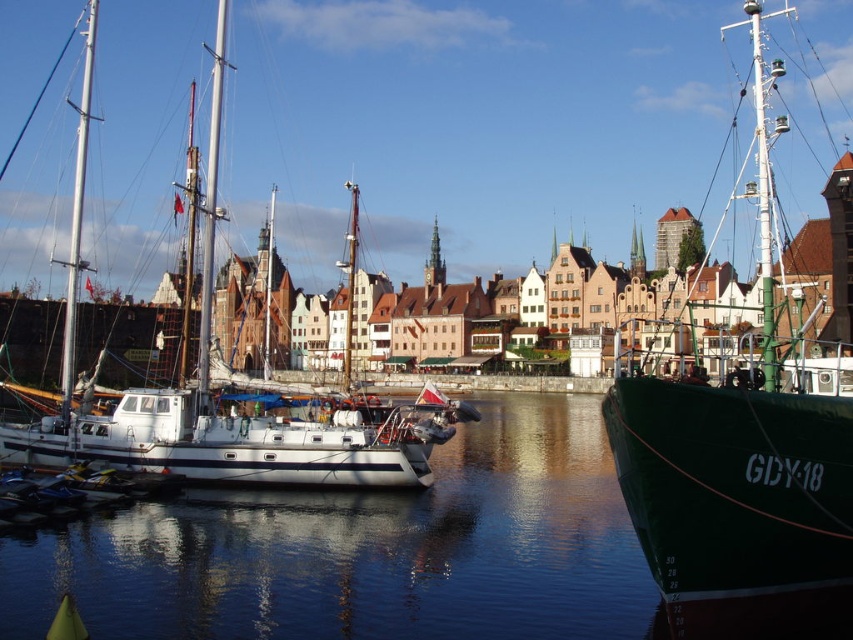
You are standing at the harbor and want to locate two specific points marked on a map. The first point is at coordinates point (583, 516) and the second is at point (393, 422). Based on the scene, which point is closer to you?

Point (583, 516) is in front of point (393, 422), so the first point is closer to you.

You are a photographer planning to capture the entire harbor scene. You notice the clear water at center and the white matte sailboat at left. Which object takes up more space in the image?

The white matte sailboat at left takes up more space in the image because the clear water at center is smaller than it.